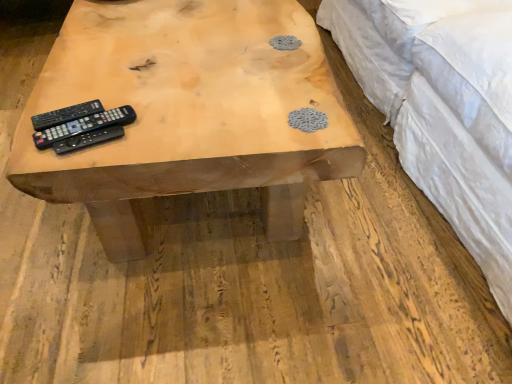
Locate an element on the screen. vacant space to the right of black matte remote control at left, which is the first remote control from back to front is located at coordinates [153, 109].